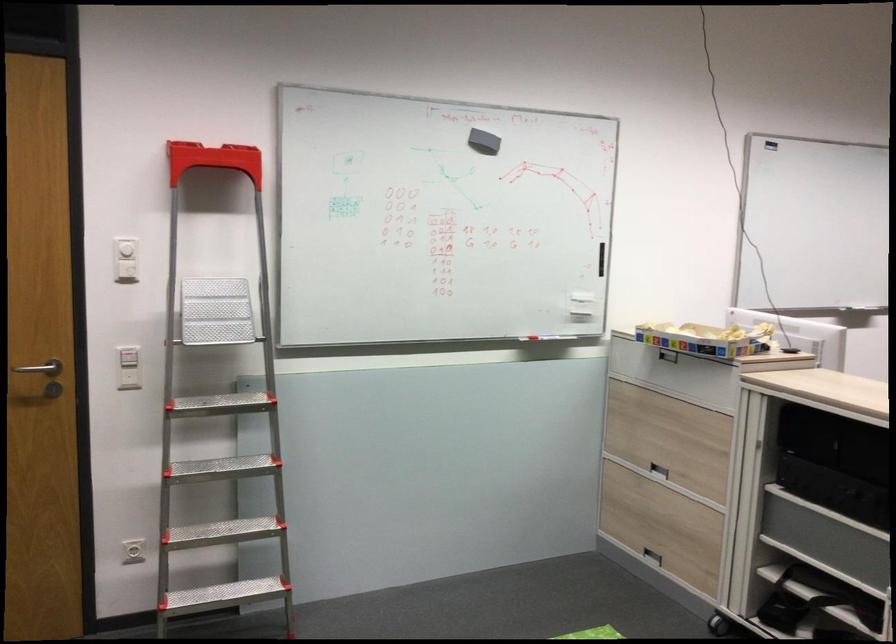
Locate an element on the screen. This screenshot has width=896, height=644. red ladder handle is located at coordinates (213, 160).